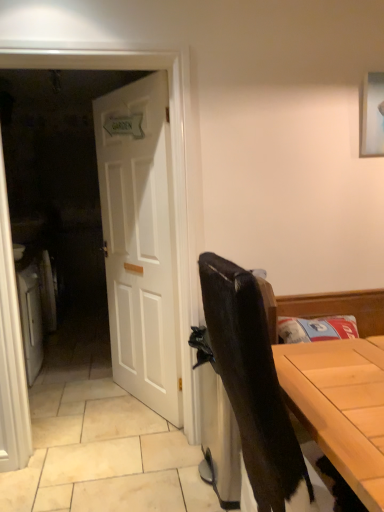
I want to click on unoccupied area in front of white wooden door at center, so click(x=125, y=423).